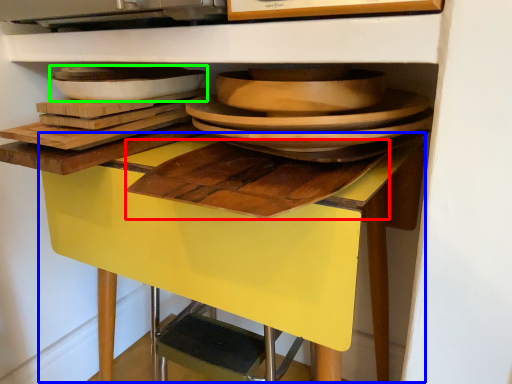
Question: Considering the real-world distances, which object is closest to cutting board (highlighted by a red box)? table (highlighted by a blue box) or platter (highlighted by a green box).

Choices:
 (A) table
 (B) platter

Answer: (A)